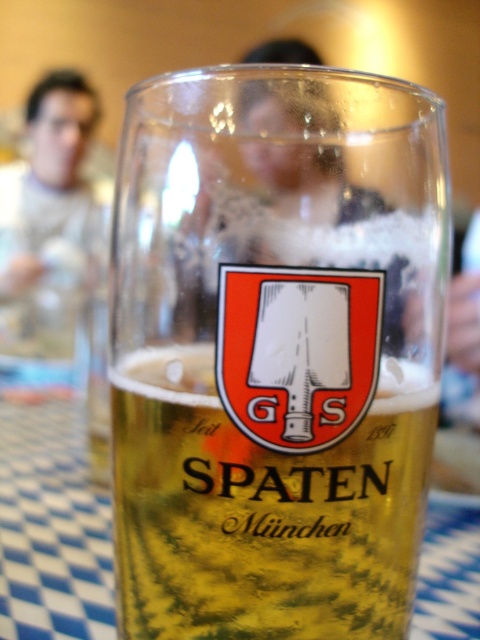
Question: Does transparent glass mug at center appear on the right side of translucent glass beer at center?

Choices:
 (A) yes
 (B) no

Answer: (B)

Question: Among these points, which one is farthest from the camera?

Choices:
 (A) (199, 596)
 (B) (404, 550)

Answer: (B)

Question: Can you confirm if transparent glass mug at center is wider than translucent glass beer at center?

Choices:
 (A) yes
 (B) no

Answer: (A)

Question: Which point is closer to the camera?

Choices:
 (A) transparent glass mug at center
 (B) translucent glass beer at center

Answer: (A)

Question: Observing the image, what is the correct spatial positioning of transparent glass mug at center in reference to translucent glass beer at center?

Choices:
 (A) right
 (B) left

Answer: (B)

Question: Which object is closer to the camera taking this photo?

Choices:
 (A) transparent glass mug at center
 (B) translucent glass beer at center

Answer: (A)